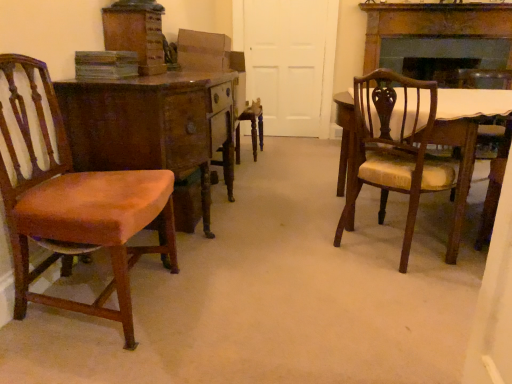
Locate an element on the screen. vacant area situated below matte brown chair at left, the first chair from the left (from a real-world perspective) is located at coordinates (106, 296).